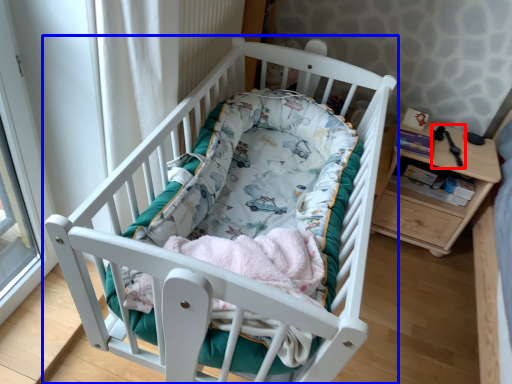
Question: Among these objects, which one is farthest to the camera, equipment (highlighted by a red box) or infant bed (highlighted by a blue box)?

Choices:
 (A) equipment
 (B) infant bed

Answer: (A)